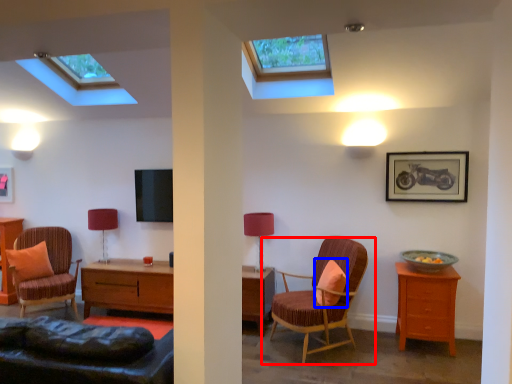
Question: Which object is further to the camera taking this photo, chair (highlighted by a red box) or pillow (highlighted by a blue box)?

Choices:
 (A) chair
 (B) pillow

Answer: (B)